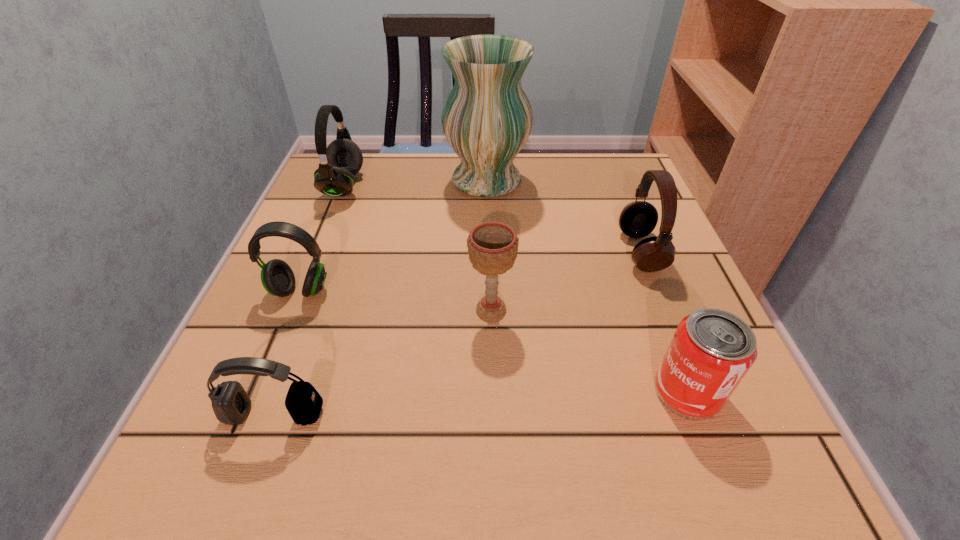
This screenshot has width=960, height=540. Identify the location of vacant space at the far edge of the desktop. (433, 195).

In the image, there is a desktop. Where is `free region at the left edge`? This screenshot has height=540, width=960. free region at the left edge is located at coordinates (296, 259).

What are the coordinates of `vacant space at the right edge of the desktop` in the screenshot? It's located at (665, 346).

Locate an element on the screen. Image resolution: width=960 pixels, height=540 pixels. free space at the far left corner is located at coordinates (373, 167).

The image size is (960, 540). Find the location of `vacant space at the near left corner of the desktop`. vacant space at the near left corner of the desktop is located at coordinates (231, 441).

The image size is (960, 540). I want to click on vacant space at the far right corner of the desktop, so click(588, 186).

You are a GUI agent. You are given a task and a screenshot of the screen. Output one action in this format:
    pyautogui.click(x=<x>, y=<y>)
    Task: Click on the free region at the near right corner
    The height and width of the screenshot is (540, 960).
    Given the screenshot: What is the action you would take?
    pyautogui.click(x=659, y=465)

You are a GUI agent. You are given a task and a screenshot of the screen. Output one action in this format:
    pyautogui.click(x=<x>, y=<y>)
    Task: Click on the unoccupied area between the vase and the can
    
    Given the screenshot: What is the action you would take?
    pyautogui.click(x=587, y=286)

In order to click on vacant space that's between the farthest headset and the can in this screenshot , I will do `click(516, 289)`.

What are the coordinates of `free space between the can and the farthest headset` in the screenshot? It's located at (516, 289).